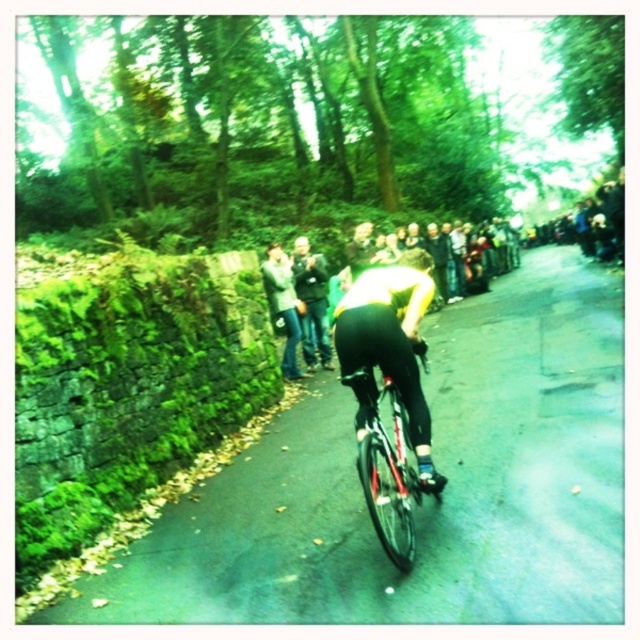
Question: Does shiny metallic bicycle at center appear under jeans at center?

Choices:
 (A) yes
 (B) no

Answer: (A)

Question: Which point is closer to the camera?

Choices:
 (A) jeans at center
 (B) shiny metallic bicycle at center

Answer: (B)

Question: Among these objects, which one is farthest from the camera?

Choices:
 (A) jeans at center
 (B) dark blue jeans at center
 (C) jeans-clad crowd at center
 (D) shiny metallic bicycle at center

Answer: (B)

Question: Can you confirm if jeans-clad crowd at center is thinner than jeans at center?

Choices:
 (A) no
 (B) yes

Answer: (A)

Question: Can you confirm if shiny metallic bicycle at center is positioned to the left of jeans at center?

Choices:
 (A) no
 (B) yes

Answer: (A)

Question: Which object is the closest to the jeans at center?

Choices:
 (A) dark blue jeans at center
 (B) jeans-clad crowd at center

Answer: (A)